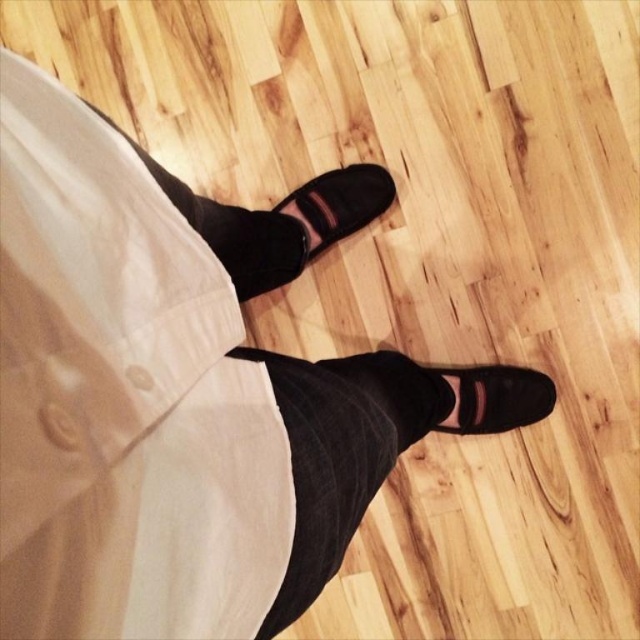
You are standing in the room and see the wooden floor with a light brown hue and visible wood grain patterns. There is a point at coordinates (339,204). What object is located at that point?

The point at coordinates (339,204) corresponds to the suede black shoe at center.